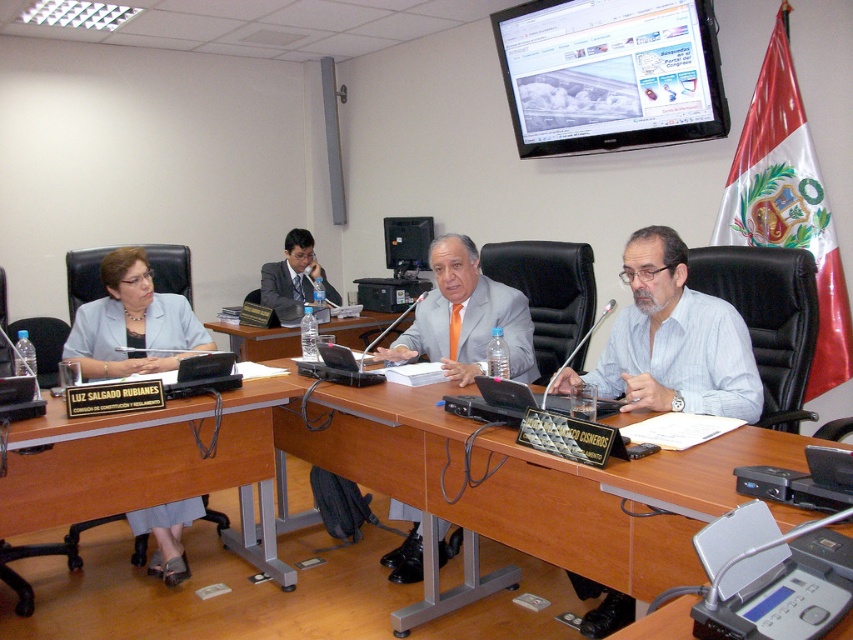
Does point (192, 451) come farther from viewer compared to point (323, 278)?

No, it is in front of (323, 278).

Describe the element at coordinates (149, 465) in the screenshot. I see `brown wood table at lower left` at that location.

You are a GUI agent. You are given a task and a screenshot of the screen. Output one action in this format:
    pyautogui.click(x=<x>, y=<y>)
    Task: Click on the brown wood table at lower left
    The width and height of the screenshot is (853, 640).
    Given the screenshot: What is the action you would take?
    pyautogui.click(x=149, y=465)

Is point (367, 323) positioned before point (308, 244)?

Yes, it is in front of point (308, 244).

Between wooden table at center and matte black suit at center, which one has more height?

With more height is matte black suit at center.

Which is behind, point (286, 348) or point (260, 275)?

Point (260, 275)

The width and height of the screenshot is (853, 640). In order to click on wooden table at center in this screenshot , I will do (258, 340).

Does white shirt at center have a lesser width compared to matte black suit at center?

Incorrect, white shirt at center's width is not less than matte black suit at center's.

Which of these two, white shirt at center or matte black suit at center, stands shorter?

white shirt at center

Is point (671, 374) closer to camera compared to point (325, 298)?

Yes, it is.

Find the location of a particular element. white shirt at center is located at coordinates (672, 340).